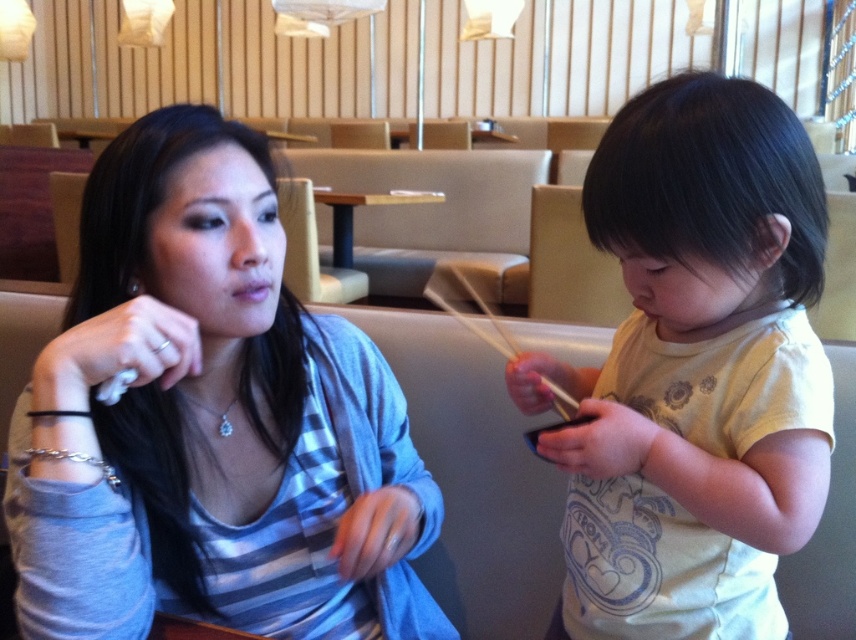
Question: Does matte gray cardigan at center have a greater width compared to light yellow cotton shirt at right?

Choices:
 (A) yes
 (B) no

Answer: (A)

Question: Is matte gray cardigan at center closer to camera compared to wooden chopsticks at center?

Choices:
 (A) yes
 (B) no

Answer: (A)

Question: Is matte gray cardigan at center smaller than wooden chopsticks at center?

Choices:
 (A) yes
 (B) no

Answer: (B)

Question: Estimate the real-world distances between objects in this image. Which object is closer to the wooden table at center?

Choices:
 (A) wooden chopsticks at center
 (B) light yellow cotton shirt at right
 (C) matte gray cardigan at center

Answer: (A)

Question: Which of the following is the farthest from the observer?

Choices:
 (A) light yellow cotton shirt at right
 (B) matte gray cardigan at center
 (C) wooden table at center
 (D) wooden chopsticks at center

Answer: (D)

Question: Which point is closer to the camera?

Choices:
 (A) matte gray cardigan at center
 (B) wooden chopsticks at center
 (C) light yellow cotton shirt at right

Answer: (C)